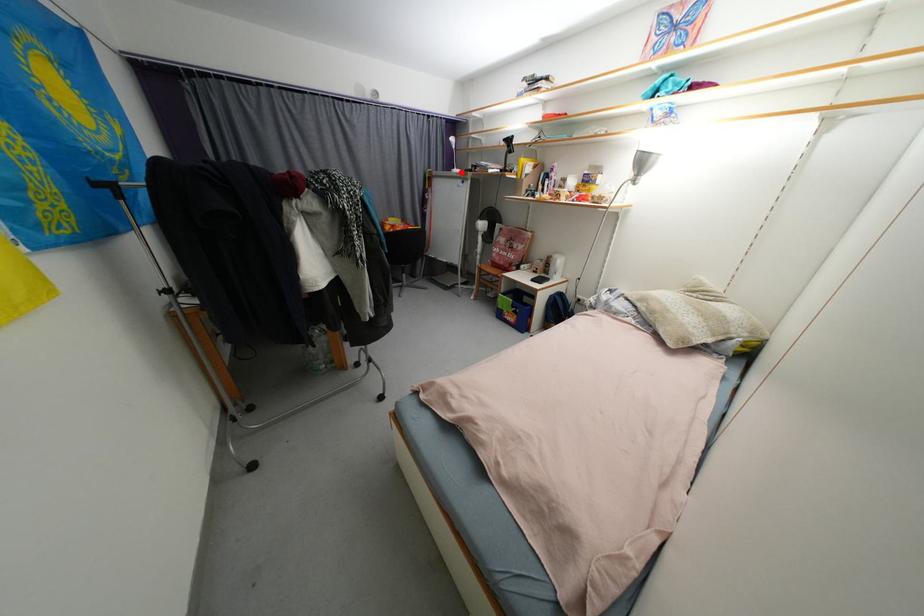
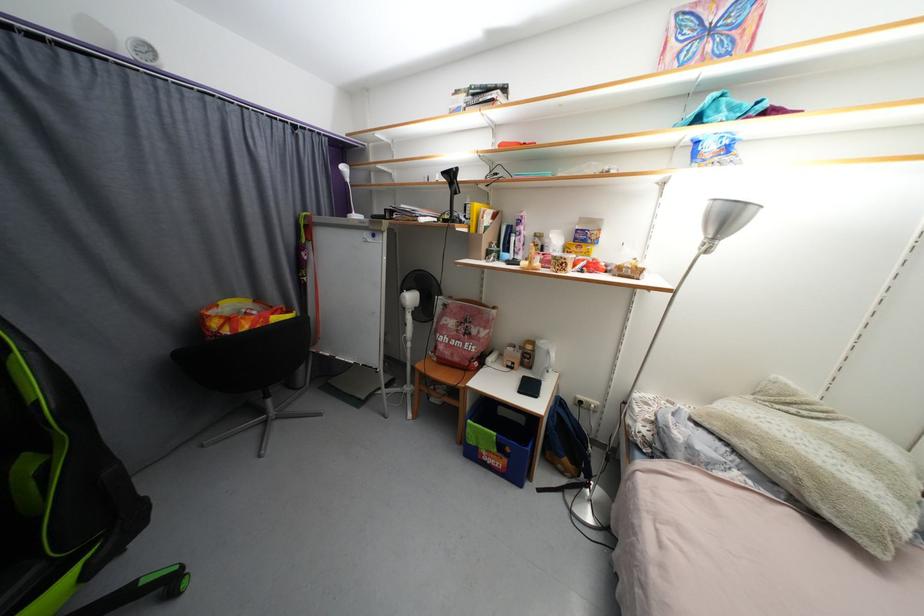
Where in the second image is the point corresponding to the highlighted location from the first image?

(360, 217)